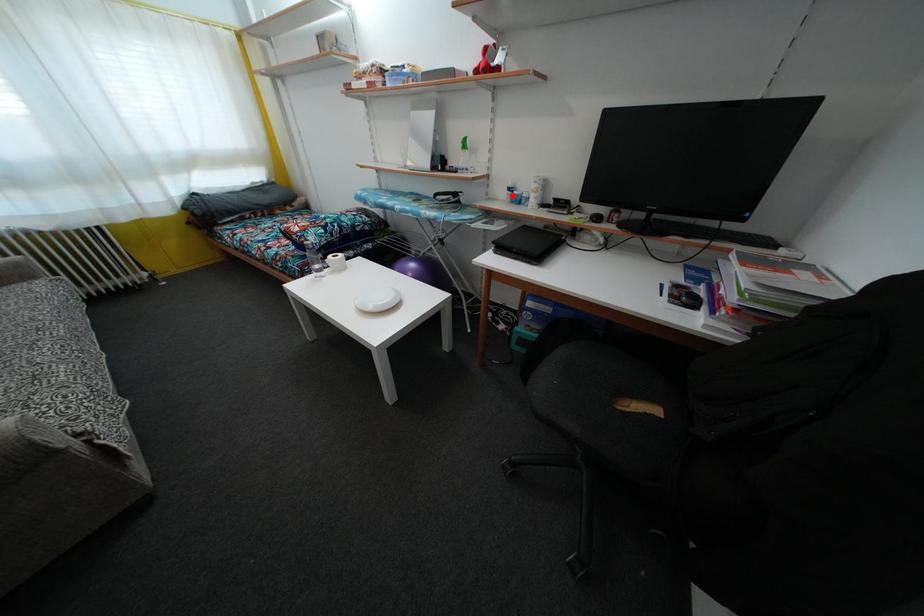
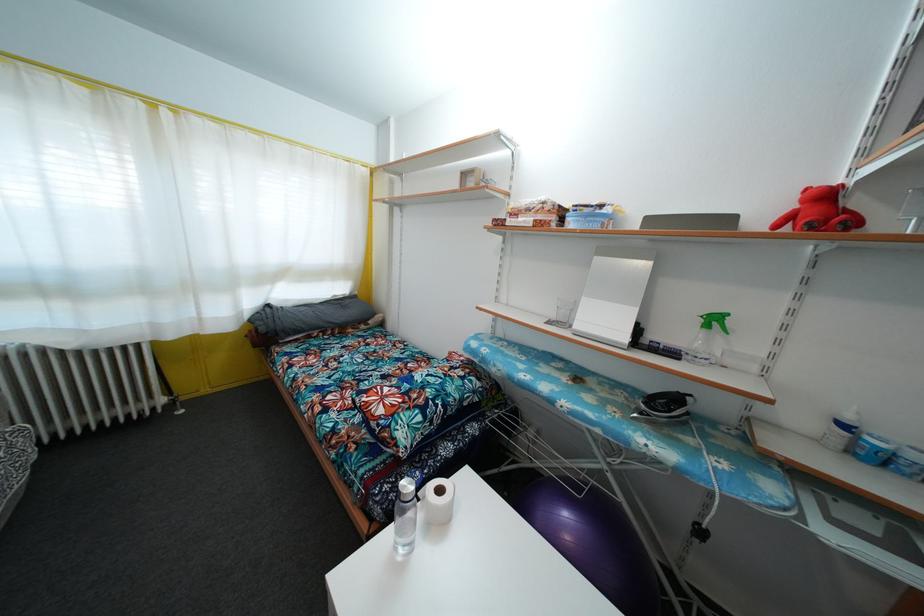
In the second image, find the point that corresponds to the highlighted location in the first image.

(848, 432)